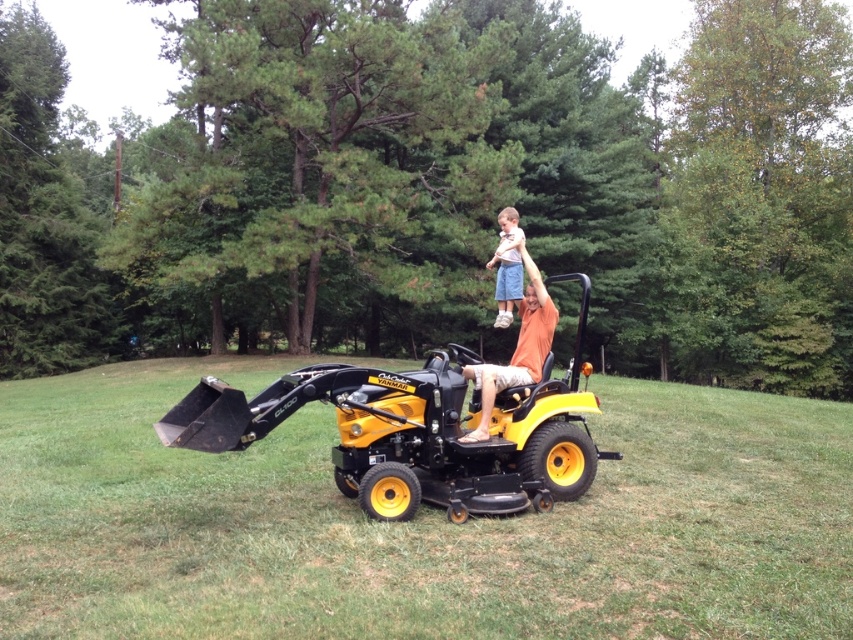
The image size is (853, 640). What do you see at coordinates (416, 524) in the screenshot?
I see `green grass at center` at bounding box center [416, 524].

Between point (82, 445) and point (537, 326), which one is positioned behind?

The point (82, 445) is more distant.

Find the location of a particular element. The height and width of the screenshot is (640, 853). green grass at center is located at coordinates (416, 524).

How much distance is there between green grass at center and light blue denim shorts at upper center?

The distance of green grass at center from light blue denim shorts at upper center is 15.62 feet.

Which is in front, point (55, 572) or point (503, 209)?

Positioned in front is point (55, 572).

Is point (599, 580) more distant than point (511, 316)?

That is False.

The height and width of the screenshot is (640, 853). In order to click on green grass at center in this screenshot , I will do `click(416, 524)`.

Does orange cotton shirt at center have a larger size compared to light blue denim shorts at upper center?

No.

Which is below, orange cotton shirt at center or light blue denim shorts at upper center?

orange cotton shirt at center is lower down.

Is point (519, 342) closer to viewer compared to point (500, 272)?

Yes, point (519, 342) is in front of point (500, 272).

I want to click on orange cotton shirt at center, so click(x=515, y=349).